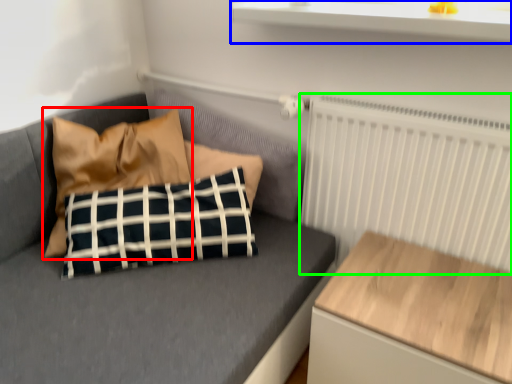
Question: Which object is positioned farthest from pillow (highlighted by a red box)? Select from window sill (highlighted by a blue box) and radiator (highlighted by a green box).

Choices:
 (A) window sill
 (B) radiator

Answer: (B)